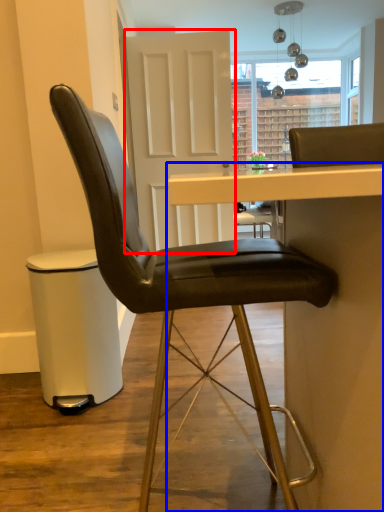
Question: Which of the following is the farthest to the observer, glass door (highlighted by a red box) or table (highlighted by a blue box)?

Choices:
 (A) glass door
 (B) table

Answer: (A)